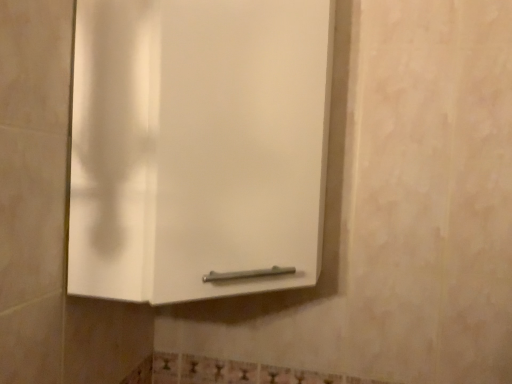
The image size is (512, 384). What are the coordinates of `white glossy cabinet at upper center` in the screenshot? It's located at (197, 146).

What do you see at coordinates (197, 146) in the screenshot? This screenshot has width=512, height=384. I see `white glossy cabinet at upper center` at bounding box center [197, 146].

Measure the distance between point (102, 228) and camera.

Point (102, 228) is 69.40 centimeters away from camera.

Measure the distance between white glossy cabinet at upper center and camera.

white glossy cabinet at upper center and camera are 26.47 inches apart.

At what (x,y) coordinates should I click in order to perform the action: click on white glossy cabinet at upper center. Please return your answer as a coordinate pair (x, y). This screenshot has width=512, height=384. Looking at the image, I should click on (197, 146).